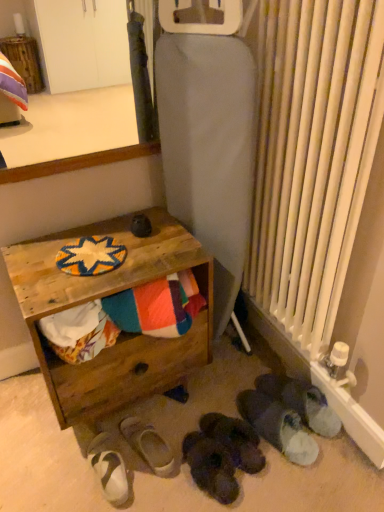
You are a GUI agent. You are given a task and a screenshot of the screen. Output one action in this format:
    pyautogui.click(x=<x>, y=<y>)
    Task: Click on the free spot to the right of white suede sandals at lower left, which ranks as the 1th footwear in left-to-right order
    The width and height of the screenshot is (384, 512).
    Given the screenshot: What is the action you would take?
    pyautogui.click(x=153, y=473)